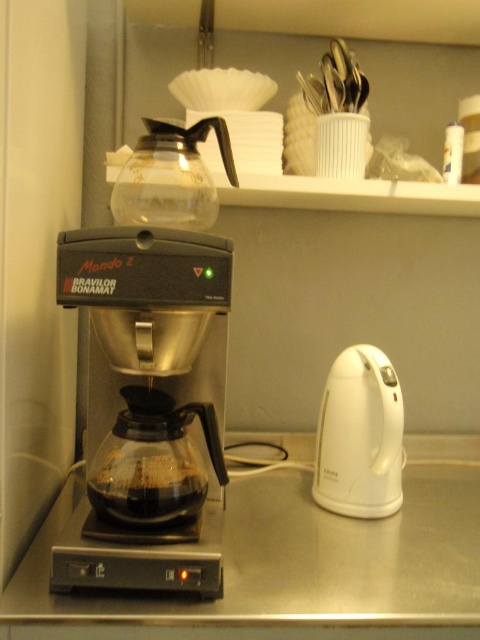
You are a barista who needs to place a 10cm tall coffee cup on the stainless steel counter at center. However, you also have a 15cm tall coffee cup that needs to be placed near the white plastic electric kettle at right. Can both cups fit vertically on their respective surfaces without tipping over?

The stainless steel counter at center is not as tall as the white plastic electric kettle at right, so the 10cm cup can fit on the counter and the 15cm cup can fit near the kettle since their heights are within the available space.

You are standing in the kitchen and want to place a 10cm wide coffee machine on the stainless steel counter at center. Is there enough space?

The stainless steel counter at center has a 2D location at point [299,563], but without knowing its dimensions, it is impossible to determine if there is enough space for a 10cm wide coffee machine.

You are setting up a kitchen counter and need to place the black plastic coffee machine at center and the white plastic electric kettle at right. If the counter has limited space, which appliance should be placed first to accommodate their sizes?

The black plastic coffee machine at center has a larger width than the white plastic electric kettle at right, so you should place the black plastic coffee machine at center first to ensure there is enough space for both appliances.